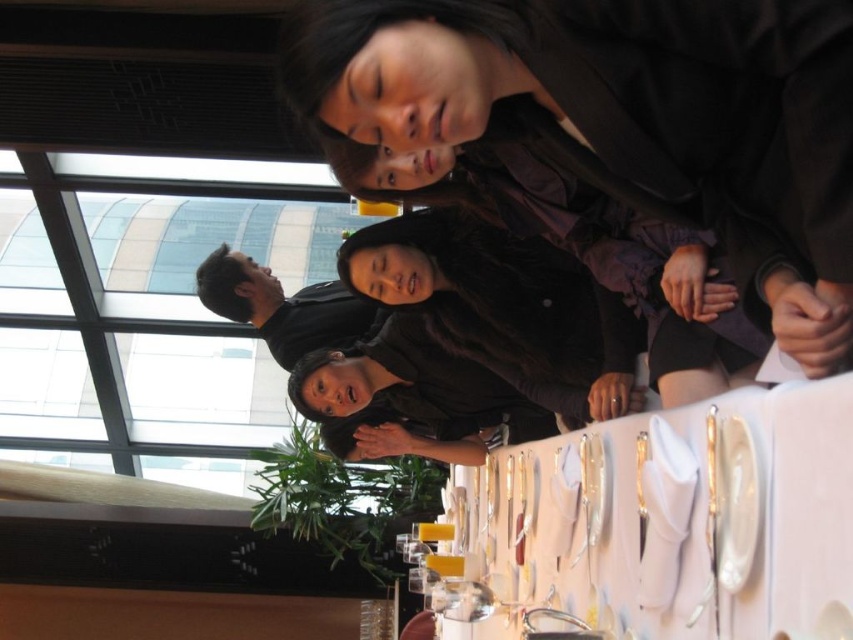
Who is lower down, dark brown leather jacket at upper center or white cloth at center?

white cloth at center

Is dark brown leather jacket at upper center to the left of white cloth at center from the viewer's perspective?

Correct, you'll find dark brown leather jacket at upper center to the left of white cloth at center.

Identify the location of dark brown leather jacket at upper center. (625, 118).